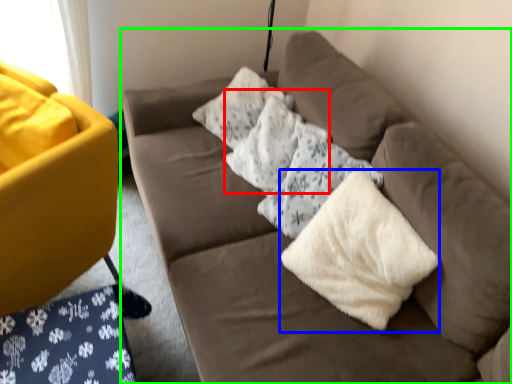
Question: Which is nearer to the pillow (highlighted by a red box)? material (highlighted by a blue box) or studio couch (highlighted by a green box).

Choices:
 (A) material
 (B) studio couch

Answer: (B)